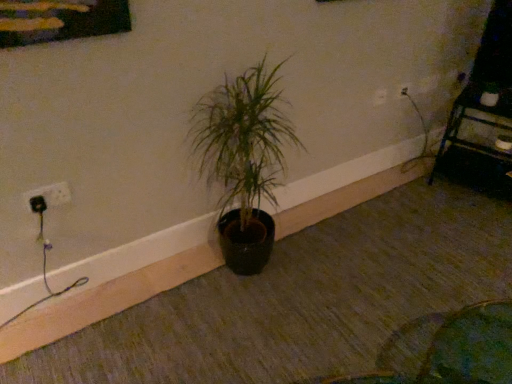
Question: Is point (372, 97) positioned closer to the camera than point (66, 185)?

Choices:
 (A) closer
 (B) farther

Answer: (B)

Question: Would you say white plastic electric outlet at upper right, acting as the second electric outlet starting from the front, is to the left or to the right of white plastic socket at left, placed as the 1th electric outlet when sorted from bottom to top, in the picture?

Choices:
 (A) right
 (B) left

Answer: (A)

Question: Based on their relative distances, which object is farther from the white plastic socket at left, placed as the second electric outlet when sorted from back to front?

Choices:
 (A) white plastic electric outlet at upper right, which is the second electric outlet in bottom-to-top order
 (B) metallic black shelf at upper right
 (C) green matte plant at center

Answer: (B)

Question: Which is nearer to the white plastic socket at left, positioned as the 1th electric outlet in front-to-back order?

Choices:
 (A) metallic black shelf at upper right
 (B) green matte plant at center
 (C) white plastic electric outlet at upper right, acting as the second electric outlet starting from the front

Answer: (B)